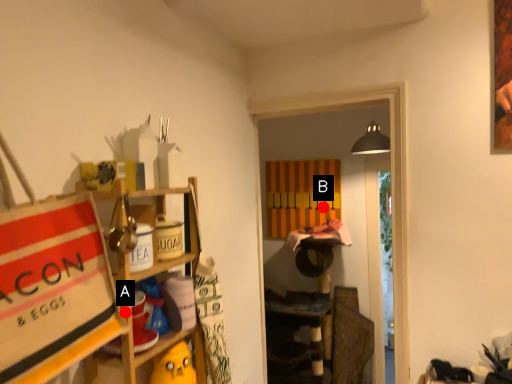
Question: Two points are circled on the image, labeled by A and B beside each circle. Among these points, which one is nearest to the camera?

Choices:
 (A) A is closer
 (B) B is closer

Answer: (A)